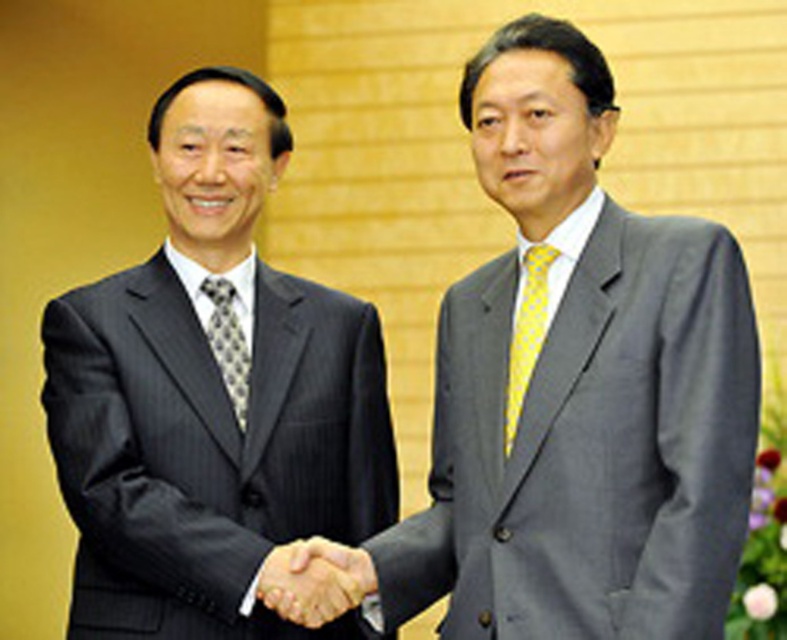
Is point (564, 429) positioned after point (379, 440)?

No, (564, 429) is in front of (379, 440).

Who is higher up, matte gray suit at center or matte black suit at left?

matte gray suit at center is higher up.

Identify the location of matte gray suit at center. (579, 388).

Is point (250, 131) positioned after point (331, 609)?

That is True.

Does point (202, 611) come behind point (331, 595)?

Yes, it is.

What are the coordinates of `matte black suit at left` in the screenshot? It's located at point(213,403).

Can you confirm if smooth skin handshake at center is wider than gray patterned tie at left?

Yes, smooth skin handshake at center is wider than gray patterned tie at left.

Between smooth skin handshake at center and gray patterned tie at left, which one is positioned higher?

gray patterned tie at left

Is point (340, 576) closer to viewer compared to point (213, 278)?

Yes, it is.

Find the location of a particular element. smooth skin handshake at center is located at coordinates (313, 580).